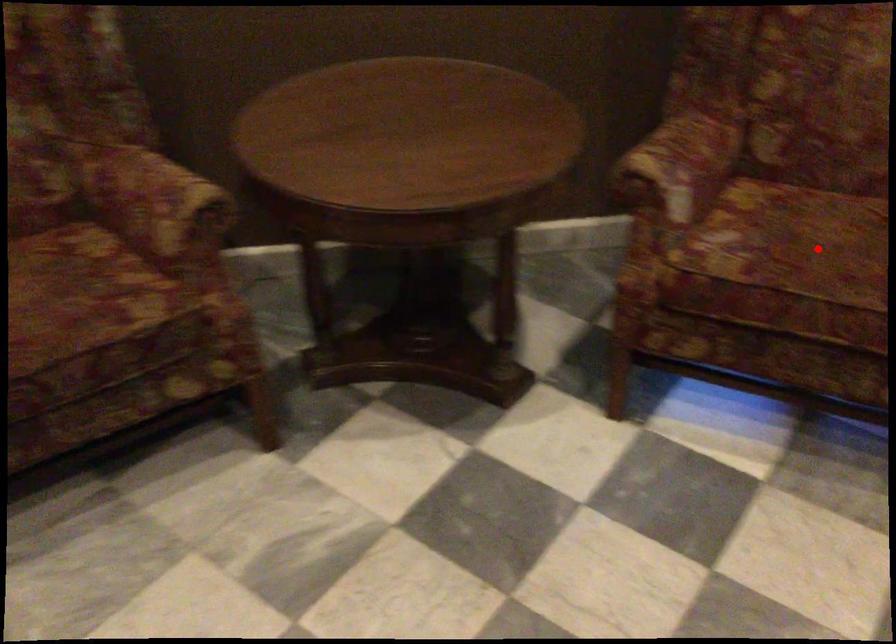
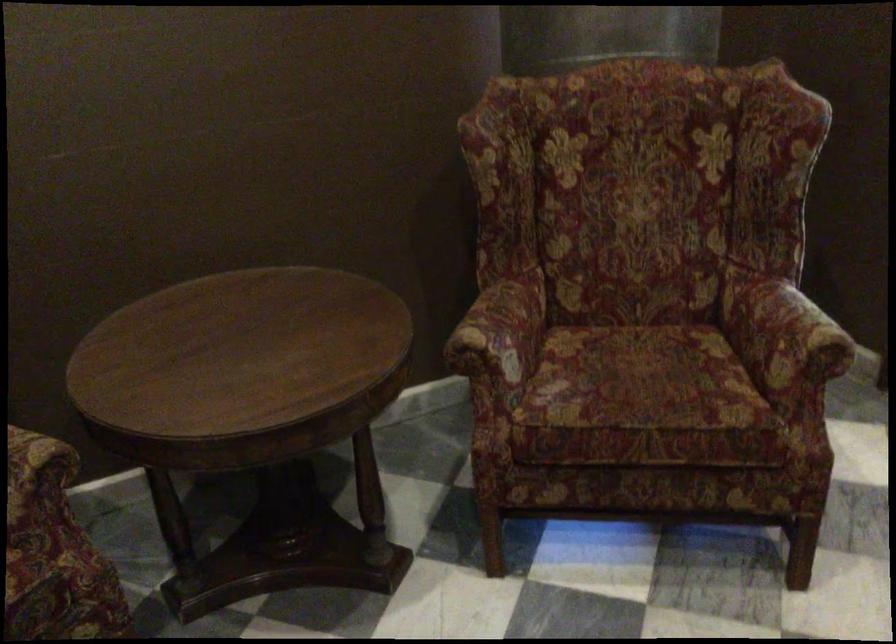
Locate, in the second image, the point that corresponds to the highlighted location in the first image.

(642, 381)